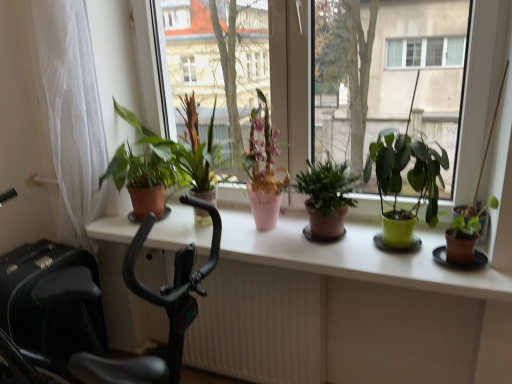
What are the coordinates of `free space in front of green matte plant at center, the 3th houseplant viewed from the left` in the screenshot? It's located at (353, 264).